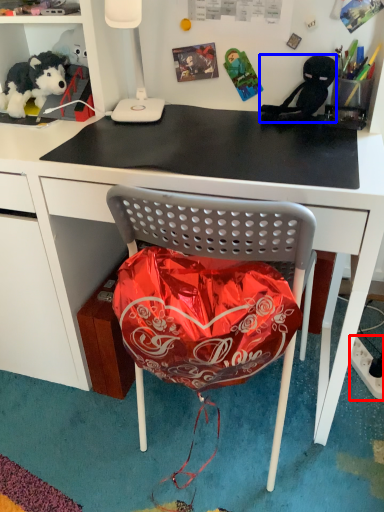
Question: Which of the following is the closest to the observer, power outlet (highlighted by a red box) or person (highlighted by a blue box)?

Choices:
 (A) power outlet
 (B) person

Answer: (B)